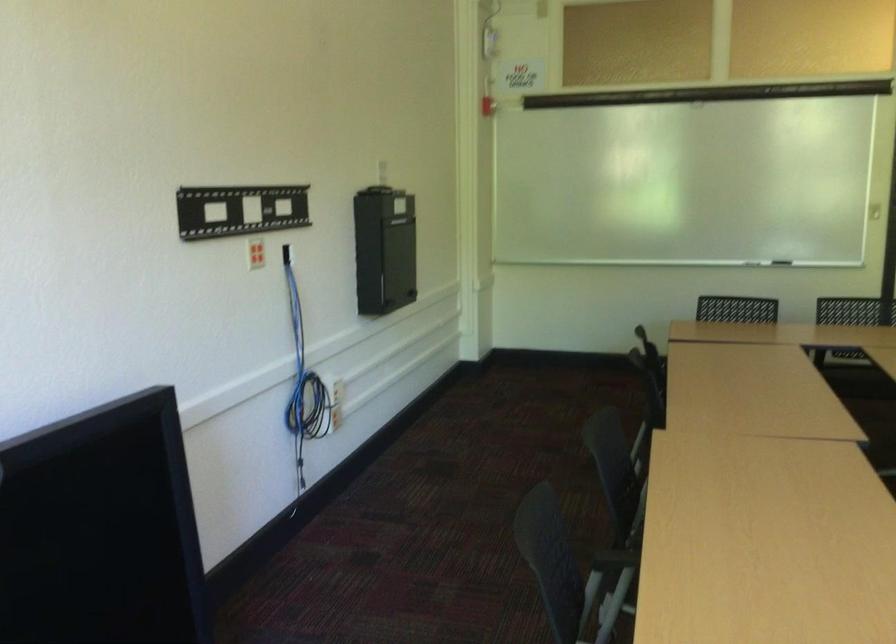
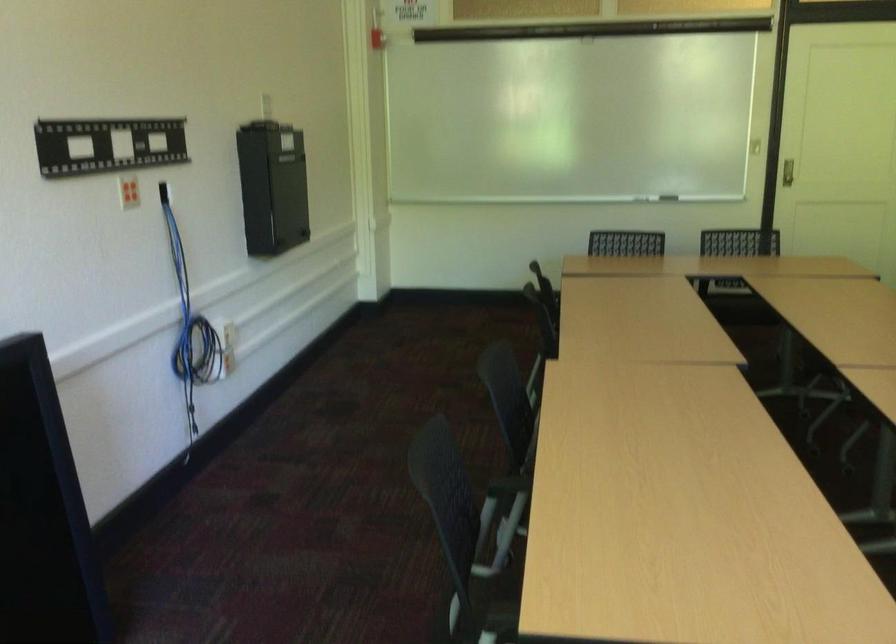
The point at (782,259) is marked in the first image. Where is the corresponding point in the second image?

(668, 198)